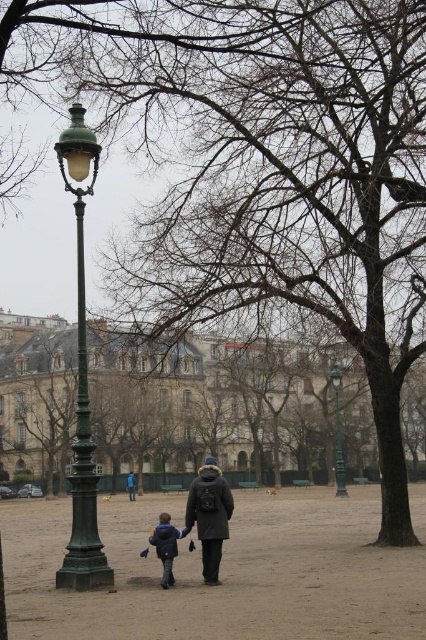
Question: Which object is positioned farthest from the dark blue jacket at center?

Choices:
 (A) green polished metal streetlamp at left
 (B) green metal lamp post at center
 (C) blue fabric jacket at center

Answer: (C)

Question: Is green polished metal streetlamp at left closer to camera compared to dark gray wool coat at center?

Choices:
 (A) yes
 (B) no

Answer: (A)

Question: Does dark gray wool coat at center come behind green metal lamp post at center?

Choices:
 (A) yes
 (B) no

Answer: (B)

Question: Considering the relative positions of green polished metal streetlamp at left and dark gray wool coat at center in the image provided, where is green polished metal streetlamp at left located with respect to dark gray wool coat at center?

Choices:
 (A) below
 (B) above

Answer: (B)

Question: Which object is farther from the camera taking this photo?

Choices:
 (A) dark gray wool coat at center
 (B) blue fabric jacket at center

Answer: (B)

Question: Which point is closer to the camera?

Choices:
 (A) (186, 532)
 (B) (131, 488)
 (C) (344, 467)
 (D) (203, 536)

Answer: (D)